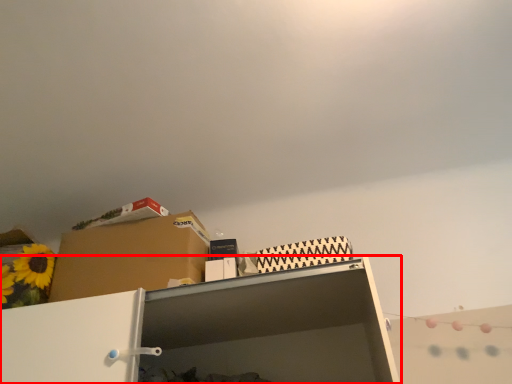
Question: Observing the image, what is the correct spatial positioning of shelf (annotated by the red box) in reference to cardboard box?

Choices:
 (A) left
 (B) right

Answer: (B)